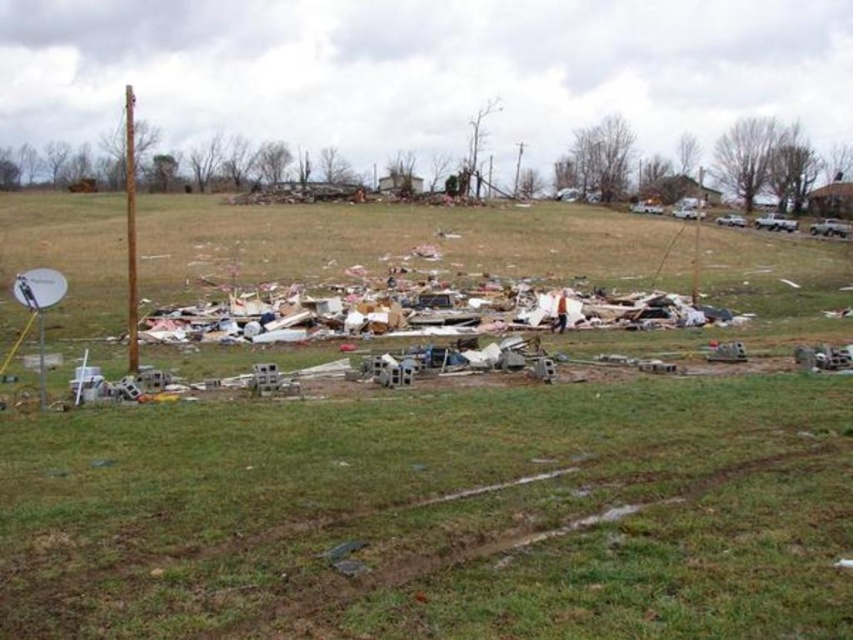
Question: Which object is farther from the camera taking this photo?

Choices:
 (A) rusty metal pole at left
 (B) green grass at center

Answer: (A)

Question: Does green grass at center appear under rusty metal pole at left?

Choices:
 (A) no
 (B) yes

Answer: (B)

Question: Can you confirm if green grass at center is bigger than rusty metal pole at left?

Choices:
 (A) no
 (B) yes

Answer: (A)

Question: Does green grass at center have a smaller size compared to rusty metal pole at left?

Choices:
 (A) yes
 (B) no

Answer: (A)